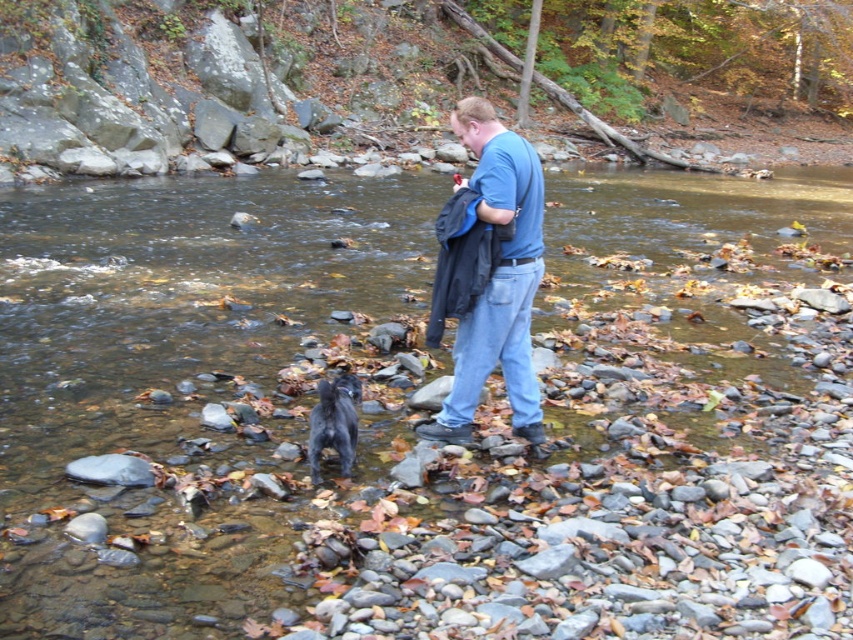
Question: Which point is closer to the camera taking this photo?

Choices:
 (A) (525, 228)
 (B) (361, 506)
 (C) (354, 381)

Answer: (B)

Question: Is smooth rock creek at center in front of blue cotton shirt at center?

Choices:
 (A) no
 (B) yes

Answer: (B)

Question: Which point is closer to the camera?

Choices:
 (A) smooth rock creek at center
 (B) blue cotton shirt at center
 (C) shiny black fur at center

Answer: (A)

Question: Which point is farther to the camera?

Choices:
 (A) (599, 480)
 (B) (506, 234)

Answer: (B)

Question: Is smooth rock creek at center to the right of shiny black fur at center from the viewer's perspective?

Choices:
 (A) yes
 (B) no

Answer: (A)

Question: Does blue cotton shirt at center have a greater width compared to shiny black fur at center?

Choices:
 (A) yes
 (B) no

Answer: (A)